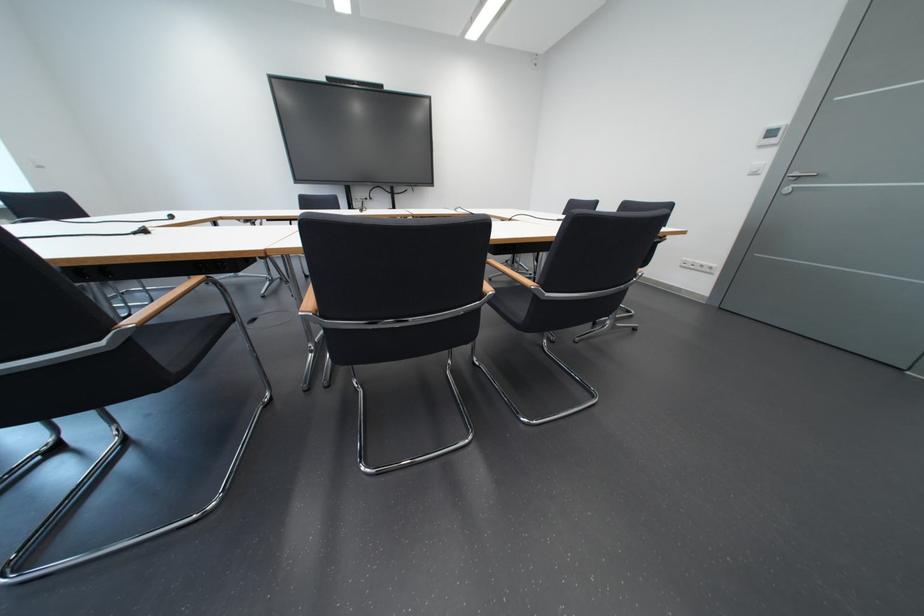
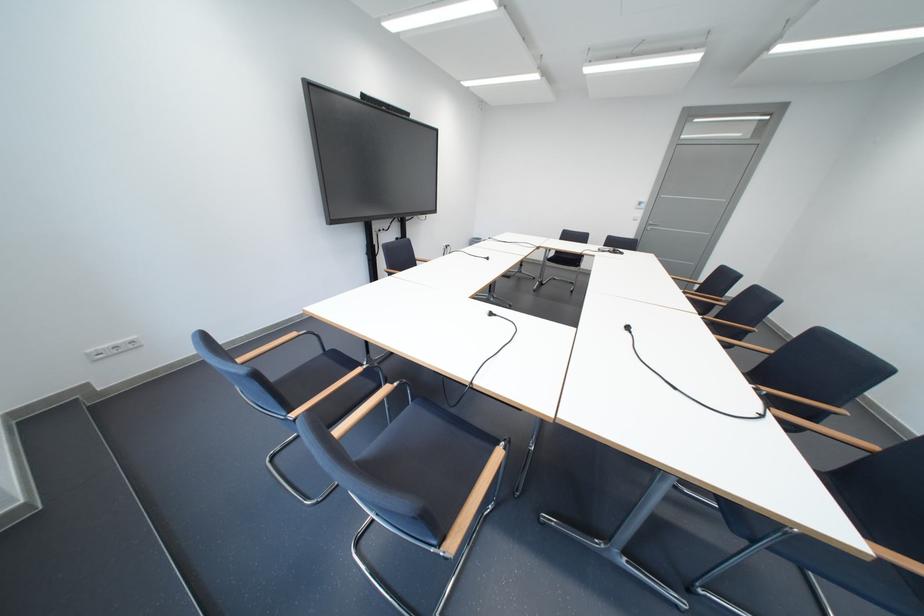
Find the pixel in the second image that matches point 185,219 in the first image.

(503, 315)